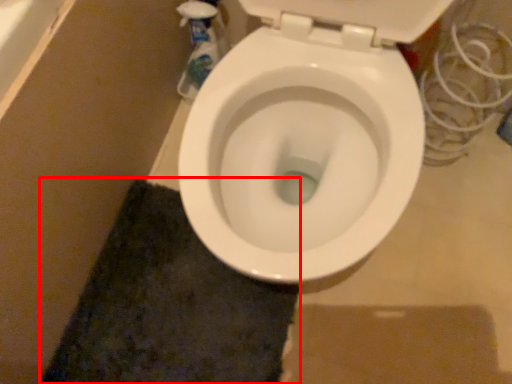
Question: Considering the relative positions of bath mat (annotated by the red box) and cleaning product in the image provided, where is bath mat (annotated by the red box) located with respect to the staircase?

Choices:
 (A) left
 (B) right

Answer: (A)